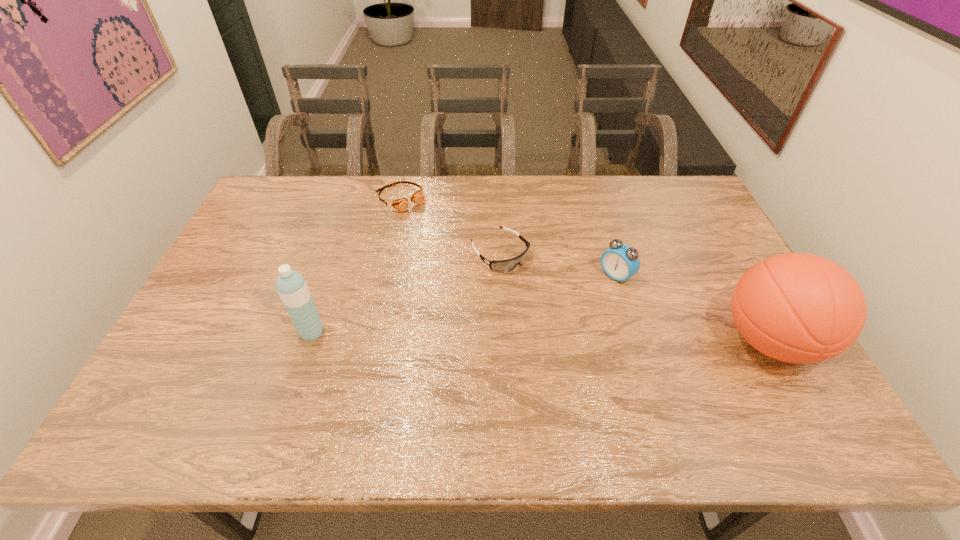
Find the location of a particular element. The width and height of the screenshot is (960, 540). free space that satisfies the following two spatial constraints: 1. on the front side of the alarm clock; 2. on the right side of the basketball is located at coordinates (636, 340).

Find the location of a particular element. The image size is (960, 540). free space that satisfies the following two spatial constraints: 1. on the front side of the nearer goggles; 2. on the left side of the farthest object is located at coordinates (389, 253).

At what (x,y) coordinates should I click in order to perform the action: click on vacant space that satisfies the following two spatial constraints: 1. on the back side of the leftmost object; 2. on the right side of the nearer goggles. Please return your answer as a coordinate pair (x, y). The height and width of the screenshot is (540, 960). Looking at the image, I should click on (338, 253).